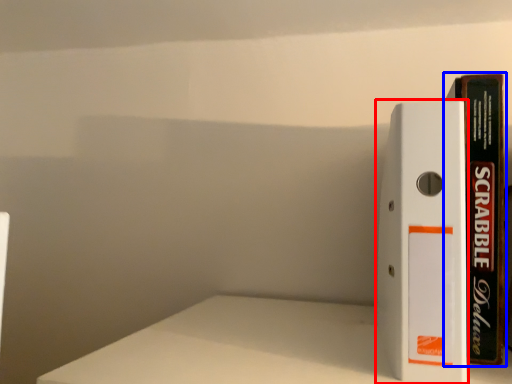
Question: Which object appears closest to the camera in this image, book (highlighted by a red box) or book (highlighted by a blue box)?

Choices:
 (A) book
 (B) book

Answer: (A)